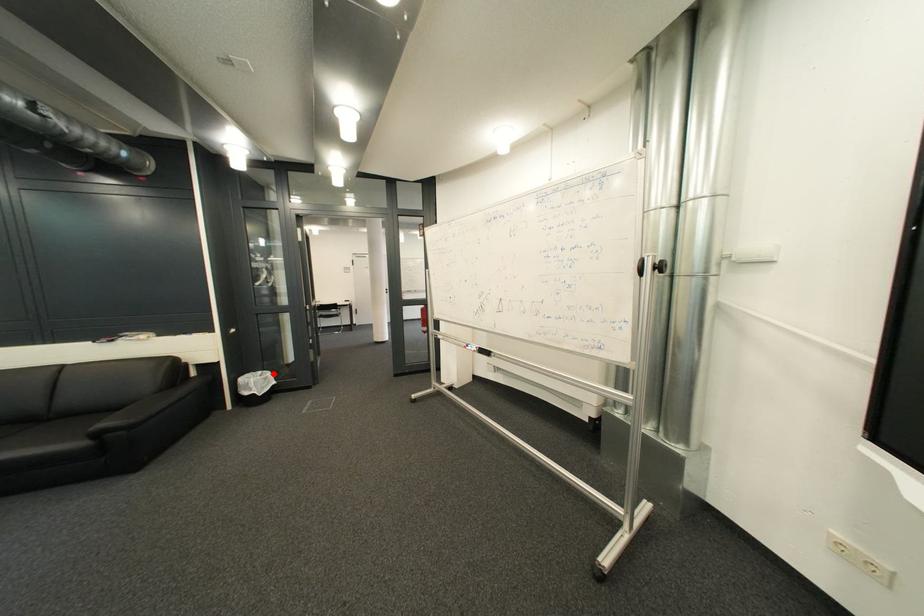
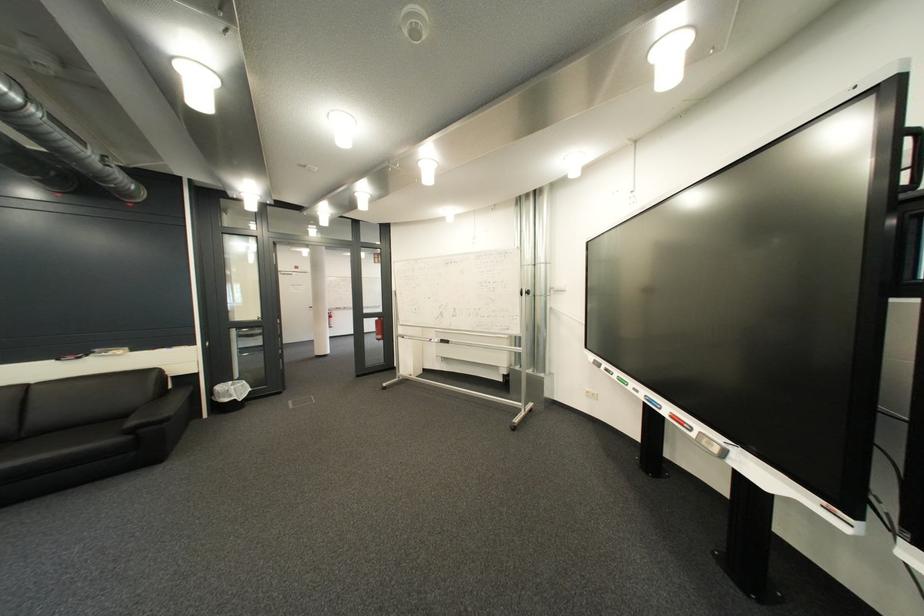
Question: I am providing you with two images of the same scene from different viewpoints. Given a red point in image1, look at the same physical point in image2. Is it:

Choices:
 (A) Closer to the viewpoint
 (B) Farther from the viewpoint

Answer: (B)